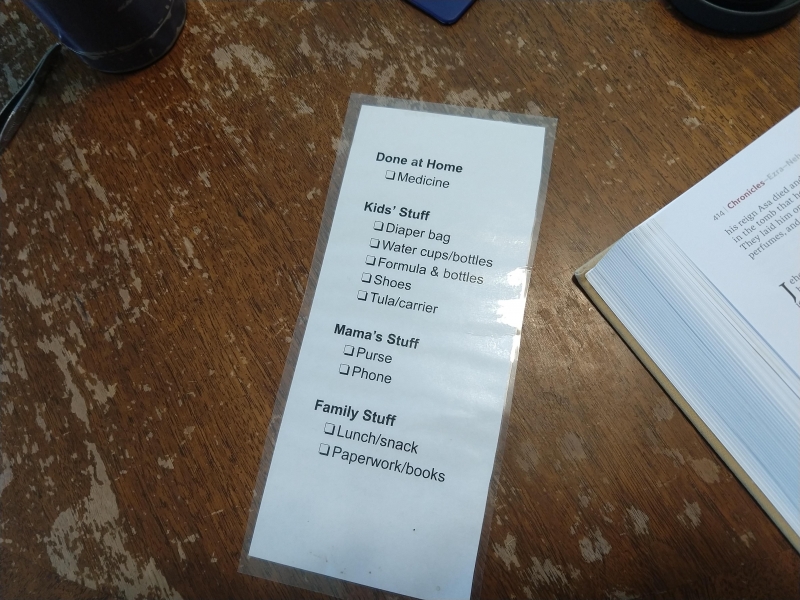
Image resolution: width=800 pixels, height=600 pixels. What are the coordinates of `metal tongs` in the screenshot? It's located at [10, 99].